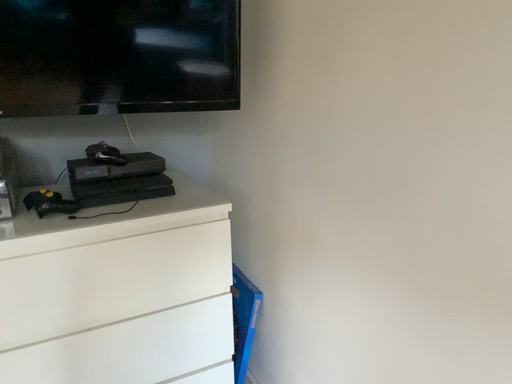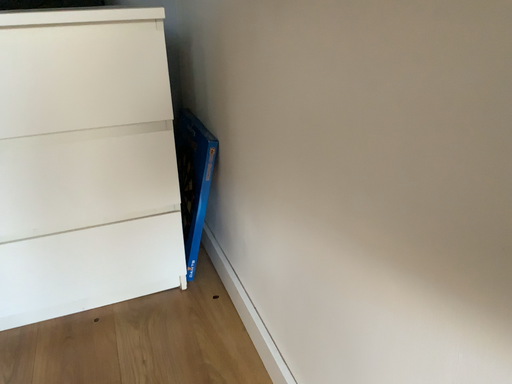
Question: How did the camera likely rotate when shooting the video?

Choices:
 (A) rotated upward
 (B) rotated downward

Answer: (B)